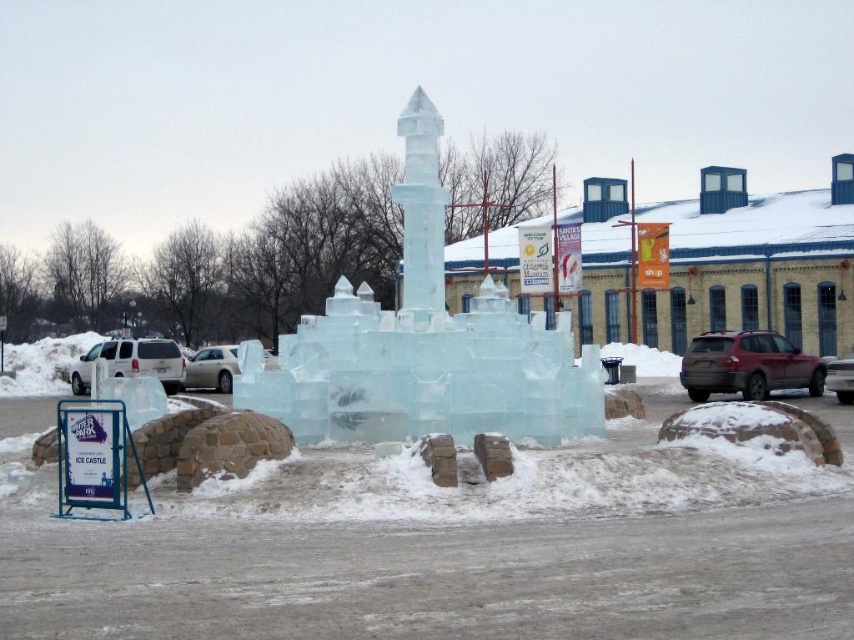
Between white matte suv at left and metallic silver suv at center, which one has less height?

With less height is metallic silver suv at center.

Is white matte suv at left taller than metallic silver suv at center?

Indeed, white matte suv at left has a greater height compared to metallic silver suv at center.

Does point (167, 346) come farther from viewer compared to point (826, 388)?

Yes, it is.

You are a GUI agent. You are given a task and a screenshot of the screen. Output one action in this format:
    pyautogui.click(x=<x>, y=<y>)
    Task: Click on the white matte suv at left
    Image resolution: width=854 pixels, height=640 pixels.
    Given the screenshot: What is the action you would take?
    pyautogui.click(x=132, y=362)

Is white matte suv at left wider than white matte car at center?

Incorrect, white matte suv at left's width does not surpass white matte car at center's.

Can you confirm if white matte suv at left is shorter than white matte car at center?

Yes, white matte suv at left is shorter than white matte car at center.

Is point (138, 344) farther from camera compared to point (223, 378)?

No, it is in front of (223, 378).

At what (x,y) coordinates should I click in order to perform the action: click on white matte suv at left. Please return your answer as a coordinate pair (x, y). The width and height of the screenshot is (854, 640). Looking at the image, I should click on (132, 362).

Who is more distant from viewer, (711, 337) or (106, 353)?

The point (106, 353) is more distant.

Locate an element on the screen. This screenshot has width=854, height=640. matte gray suv at right is located at coordinates (747, 365).